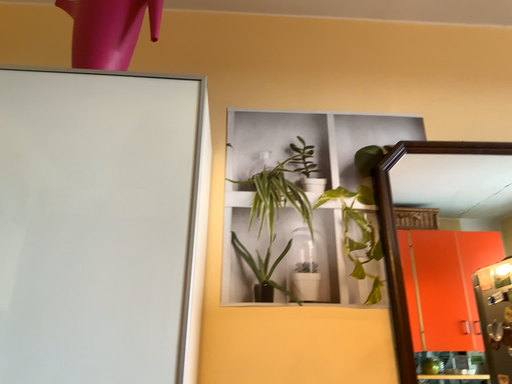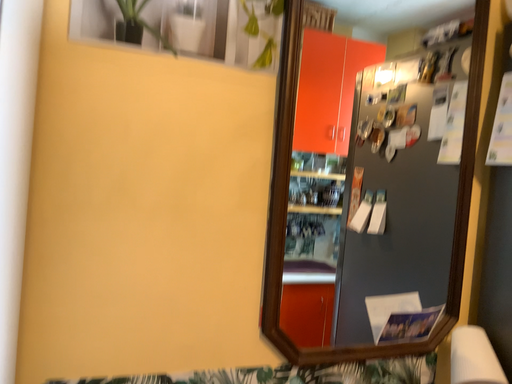
Question: Which way did the camera rotate in the video?

Choices:
 (A) rotated right
 (B) rotated left

Answer: (A)